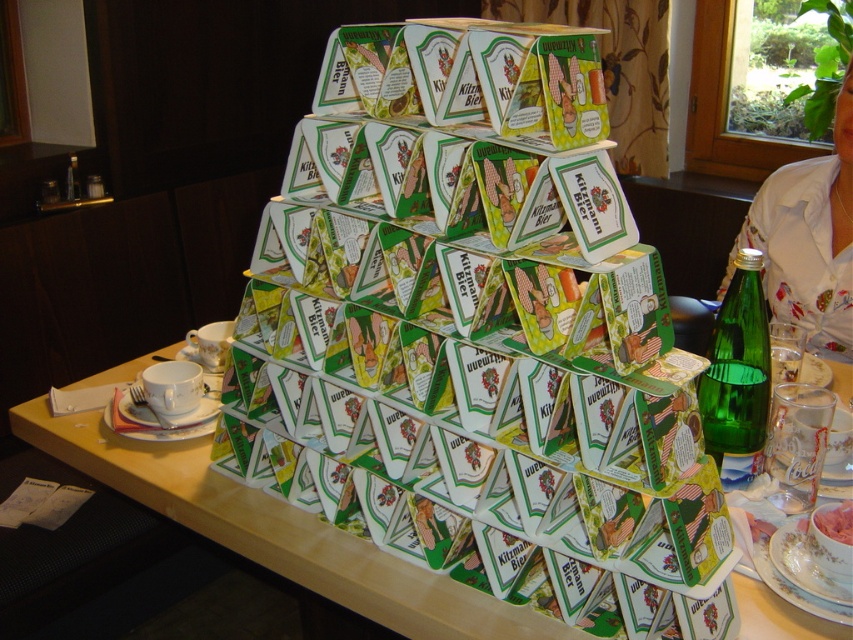
Question: Is green cardboard house at center smaller than white floral shirt at upper right?

Choices:
 (A) no
 (B) yes

Answer: (A)

Question: In this image, where is green cardboard house at center located relative to white floral shirt at upper right?

Choices:
 (A) right
 (B) left

Answer: (B)

Question: Which point is closer to the camera?

Choices:
 (A) (733, 321)
 (B) (764, 608)
 (C) (228, 372)
 (D) (753, 195)

Answer: (B)

Question: Which point appears closest to the camera in this image?

Choices:
 (A) (721, 358)
 (B) (663, 333)
 (C) (838, 625)

Answer: (C)

Question: Which point appears farthest from the camera in this image?

Choices:
 (A) (207, 449)
 (B) (244, 419)

Answer: (A)

Question: Is green cardboard house at center thinner than white floral shirt at upper right?

Choices:
 (A) yes
 (B) no

Answer: (B)